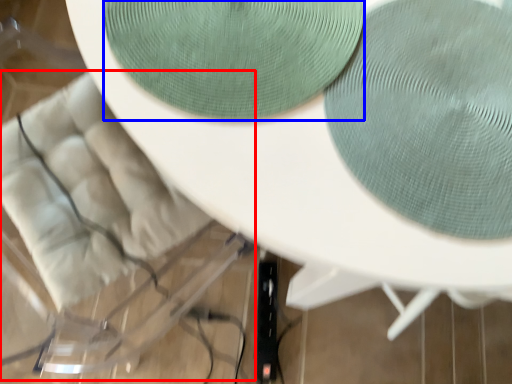
Question: Among these objects, which one is farthest to the camera, swivel chair (highlighted by a red box) or oval (highlighted by a blue box)?

Choices:
 (A) swivel chair
 (B) oval

Answer: (A)